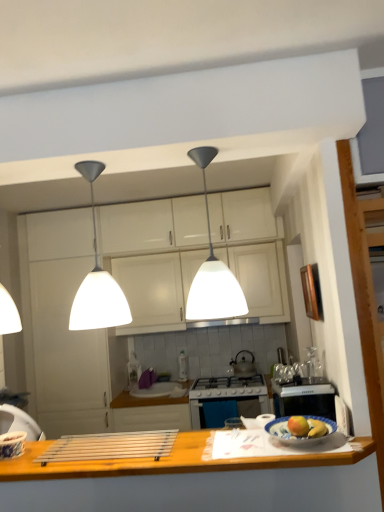
The height and width of the screenshot is (512, 384). What are the coordinates of `metallic silver faucet at center` in the screenshot? It's located at (243, 364).

What do you see at coordinates (183, 366) in the screenshot? I see `metallic silver kettle at center` at bounding box center [183, 366].

The height and width of the screenshot is (512, 384). I want to click on blue glossy plate at lower right, so click(297, 436).

How much space does white matte pendant light at center, the 1th light when ordered from left to right, occupy horizontally?

The width of white matte pendant light at center, the 1th light when ordered from left to right, is 8.43 inches.

The image size is (384, 512). Identify the location of matte yellow apple at center, positioned as the 1th apple in right-to-left order. (306, 426).

The width and height of the screenshot is (384, 512). Describe the element at coordinates (306, 426) in the screenshot. I see `matte yellow apple at center, positioned as the 1th apple in right-to-left order` at that location.

Locate an element on the screen. yellow matte apple at center, the 2th apple when ordered from right to left is located at coordinates (298, 426).

Is point (183, 370) more distant than point (275, 432)?

Yes, it is.

Is blue glossy plate at lower right at the back of metallic silver kettle at center?

No, metallic silver kettle at center is not facing away from blue glossy plate at lower right.

Is blue glossy plate at lower right located within metallic silver kettle at center?

No, blue glossy plate at lower right is not surrounded by metallic silver kettle at center.

Based on the photo, is the surface of white matte pendant light at center, the 1th light when ordered from left to right, in direct contact with metallic silver kettle at center?

No, white matte pendant light at center, the 1th light when ordered from left to right, is not beside metallic silver kettle at center.

Considering the relative sizes of white matte pendant light at center, the 1th light when ordered from left to right, and metallic silver kettle at center in the image provided, is white matte pendant light at center, the 1th light when ordered from left to right, bigger than metallic silver kettle at center?

Yes, white matte pendant light at center, the 1th light when ordered from left to right, is bigger than metallic silver kettle at center.

The image size is (384, 512). Find the location of `appliance lying behind the white matte pendant light at center, arranged as the 2th light when viewed from the right`. appliance lying behind the white matte pendant light at center, arranged as the 2th light when viewed from the right is located at coordinates (183, 366).

Which object is wider, white matte pendant light at center, arranged as the 2th light when viewed from the right, or metallic silver kettle at center?

Wider between the two is white matte pendant light at center, arranged as the 2th light when viewed from the right.

Is satin silver exhaust hood at center at the left side of metallic silver faucet at center?

Indeed, satin silver exhaust hood at center is positioned on the left side of metallic silver faucet at center.

Between satin silver exhaust hood at center and metallic silver faucet at center, which one has larger size?

Bigger between the two is satin silver exhaust hood at center.

Find the location of a particular element. This screenshot has width=384, height=512. kitchen appliance below the satin silver exhaust hood at center (from the image's perspective) is located at coordinates (243, 364).

Is satin silver exhaust hood at center thinner than metallic silver faucet at center?

In fact, satin silver exhaust hood at center might be wider than metallic silver faucet at center.

From the picture: Can you tell me how much satin silver exhaust hood at center and white glossy cabinets at center, which is the first cabinetry in top-to-bottom order, differ in facing direction?

satin silver exhaust hood at center and white glossy cabinets at center, which is the first cabinetry in top-to-bottom order, are facing 0.309 degrees away from each other.

Is the depth of satin silver exhaust hood at center less than that of white glossy cabinets at center, the second cabinetry when ordered from bottom to top?

No, satin silver exhaust hood at center is behind white glossy cabinets at center, the second cabinetry when ordered from bottom to top.

Does satin silver exhaust hood at center appear on the right side of white glossy cabinets at center, which is the first cabinetry in top-to-bottom order?

Correct, you'll find satin silver exhaust hood at center to the right of white glossy cabinets at center, which is the first cabinetry in top-to-bottom order.

From the image's perspective, relative to yellow matte apple at center, the 2th apple when ordered from right to left, is white matte cabinet at center, which is the first cabinetry in bottom-to-top order, above or below?

Based on their image positions, white matte cabinet at center, which is the first cabinetry in bottom-to-top order, is located above yellow matte apple at center, the 2th apple when ordered from right to left.

From a real-world perspective, who is located higher, white matte cabinet at center, positioned as the second cabinetry in top-to-bottom order, or yellow matte apple at center, the 1th apple in the left-to-right sequence?

white matte cabinet at center, positioned as the second cabinetry in top-to-bottom order, from a real-world perspective.

Is white matte cabinet at center, positioned as the second cabinetry in top-to-bottom order, bigger or smaller than yellow matte apple at center, the 1th apple in the left-to-right sequence?

In the image, white matte cabinet at center, positioned as the second cabinetry in top-to-bottom order, appears to be larger than yellow matte apple at center, the 1th apple in the left-to-right sequence.

Are white matte cabinet at center, which is the first cabinetry in bottom-to-top order, and yellow matte apple at center, the 2th apple when ordered from right to left, far apart?

Yes, white matte cabinet at center, which is the first cabinetry in bottom-to-top order, and yellow matte apple at center, the 2th apple when ordered from right to left, are located far from each other.

From the picture: Is metallic silver kettle at center to the right of metallic silver faucet at center from the viewer's perspective?

No.

How much distance is there between metallic silver kettle at center and metallic silver faucet at center?

metallic silver kettle at center is 19.52 inches from metallic silver faucet at center.

From a real-world perspective, who is located higher, metallic silver kettle at center or metallic silver faucet at center?

metallic silver faucet at center, from a real-world perspective.

Is metallic silver kettle at center further to the viewer compared to metallic silver faucet at center?

Yes, it is.

Is white matte pendant light at center, arranged as the 2th light when viewed from the right, facing towards blue glossy plate at lower right?

No, white matte pendant light at center, arranged as the 2th light when viewed from the right, is not oriented towards blue glossy plate at lower right.

Measure the distance from white matte pendant light at center, arranged as the 2th light when viewed from the right, to blue glossy plate at lower right.

29.83 inches.

Can you confirm if white matte pendant light at center, the 1th light when ordered from left to right, is positioned to the left of blue glossy plate at lower right?

Yes, white matte pendant light at center, the 1th light when ordered from left to right, is to the left of blue glossy plate at lower right.

Considering the relative sizes of white matte pendant light at center, the 1th light when ordered from left to right, and blue glossy plate at lower right in the image provided, is white matte pendant light at center, the 1th light when ordered from left to right, taller than blue glossy plate at lower right?

Yes, white matte pendant light at center, the 1th light when ordered from left to right, is taller than blue glossy plate at lower right.

I want to click on appliance lying behind the blue glossy plate at lower right, so click(x=183, y=366).

At what (x,y) coordinates should I click in order to perform the action: click on appliance below the white matte pendant light at center, the 1th light when ordered from left to right (from the image's perspective). Please return your answer as a coordinate pair (x, y). Image resolution: width=384 pixels, height=512 pixels. Looking at the image, I should click on (183, 366).

In the scene shown: Considering their positions, is metallic silver faucet at center positioned closer to matte yellow apple at center, positioned as the 1th apple in right-to-left order, than white matte pendant light at center, arranged as the 2th light when viewed from the right?

Among the two, white matte pendant light at center, arranged as the 2th light when viewed from the right, is located nearer to matte yellow apple at center, positioned as the 1th apple in right-to-left order.

Consider the image. Considering their positions, is metallic silver kettle at center positioned closer to matte yellow apple at center, positioned as the 1th apple in right-to-left order, than yellow matte apple at center, the 1th apple in the left-to-right sequence?

yellow matte apple at center, the 1th apple in the left-to-right sequence, is closer to matte yellow apple at center, positioned as the 1th apple in right-to-left order.

Looking at the image, which one is located further to metallic silver faucet at center, metallic silver kettle at center or matte yellow apple at center, which is the 2th apple in left-to-right order?

The object further to metallic silver faucet at center is matte yellow apple at center, which is the 2th apple in left-to-right order.

Estimate the real-world distances between objects in this image. Which object is closer to white matte cabinet at center, which is the first cabinetry in bottom-to-top order, white matte pendant light at center, arranged as the 2th light when viewed from the right, or white glossy cabinets at center, the second cabinetry when ordered from bottom to top?

Among the two, white glossy cabinets at center, the second cabinetry when ordered from bottom to top, is located nearer to white matte cabinet at center, which is the first cabinetry in bottom-to-top order.

From the image, which object appears to be nearer to metallic silver faucet at center, yellow matte apple at center, the 2th apple when ordered from right to left, or white glossy cabinets at center, the second cabinetry when ordered from bottom to top?

Based on the image, white glossy cabinets at center, the second cabinetry when ordered from bottom to top, appears to be nearer to metallic silver faucet at center.

Which object lies nearer to the anchor point metallic silver faucet at center, white matte pendant light at center, positioned as the first light in right-to-left order, or wooden at lower center?

white matte pendant light at center, positioned as the first light in right-to-left order, is closer to metallic silver faucet at center.

When comparing their distances from satin silver exhaust hood at center, does white matte pendant light at center, arranged as the 2th light when viewed from the right, or metallic silver faucet at center seem further?

The object further to satin silver exhaust hood at center is white matte pendant light at center, arranged as the 2th light when viewed from the right.

When comparing their distances from white matte pendant light at center, marked as the 2th light in a left-to-right arrangement, does matte yellow apple at center, positioned as the 1th apple in right-to-left order, or metallic silver kettle at center seem closer?

The object closer to white matte pendant light at center, marked as the 2th light in a left-to-right arrangement, is matte yellow apple at center, positioned as the 1th apple in right-to-left order.

At what (x,y) coordinates should I click in order to perform the action: click on apple between white matte pendant light at center, marked as the 2th light in a left-to-right arrangement, and metallic silver kettle at center, along the z-axis. Please return your answer as a coordinate pair (x, y). This screenshot has height=512, width=384. Looking at the image, I should click on (298, 426).

Locate an element on the screen. This screenshot has height=512, width=384. cabinetry between white matte pendant light at center, arranged as the 2th light when viewed from the right, and white matte cabinet at center, which is the first cabinetry in bottom-to-top order, in the front-back direction is located at coordinates (154, 256).

The image size is (384, 512). Find the location of `exhaust hood between white matte pendant light at center, positioned as the first light in right-to-left order, and metallic silver kettle at center, along the z-axis`. exhaust hood between white matte pendant light at center, positioned as the first light in right-to-left order, and metallic silver kettle at center, along the z-axis is located at coordinates (222, 322).

In order to click on kitchen appliance between white matte pendant light at center, the 1th light when ordered from left to right, and metallic silver kettle at center in the front-back direction in this screenshot , I will do `click(243, 364)`.